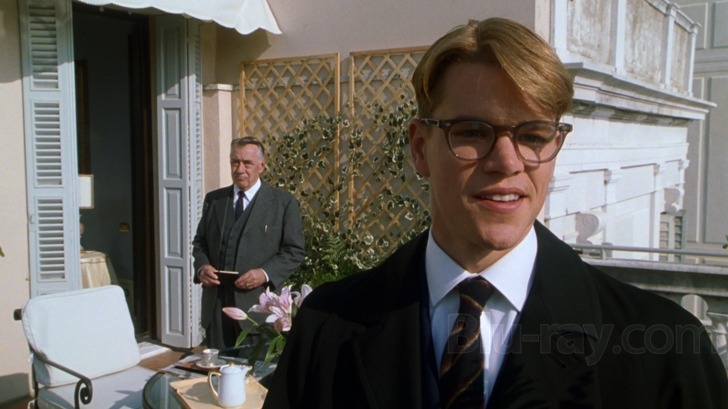
Locate an element on the screen. teacup is located at coordinates (210, 357).